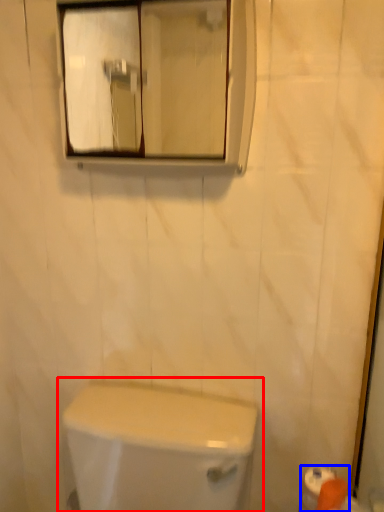
Question: Which object appears closest to the camera in this image, toilet (highlighted by a red box) or toilet paper (highlighted by a blue box)?

Choices:
 (A) toilet
 (B) toilet paper

Answer: (A)